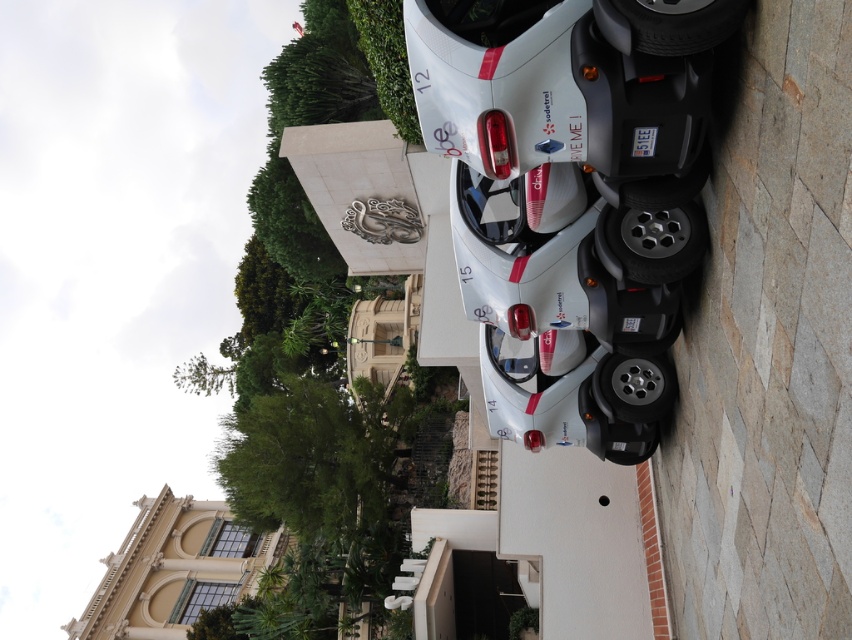
Looking at this image, you are standing in front of the white electric car with red accents. There are two points marked on the pavement near the car. One is at coordinate point (658,49) and the other at point (616,212). Which point is closer to you?

Point (658,49) is closer to the camera than point (616,212).

Consider the image. You are a delivery person who needs to check the tire pressure of both the metallic silver tire at center and the black rubber tire at lower right. Since you can only check one tire at a time, which tire should you check first based on their positions?

You should check the metallic silver tire at center first because it is closer to you than the black rubber tire at lower right, making it more accessible.